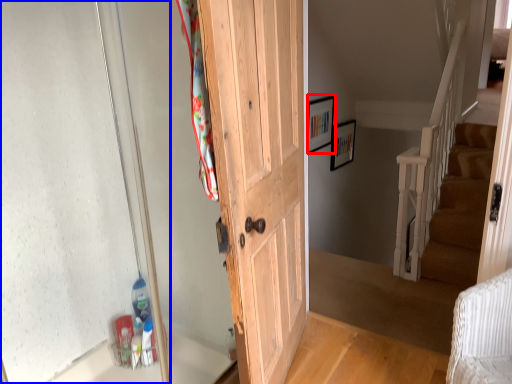
Question: Among these objects, which one is nearest to the camera, picture frame (highlighted by a red box) or glass door (highlighted by a blue box)?

Choices:
 (A) picture frame
 (B) glass door

Answer: (B)